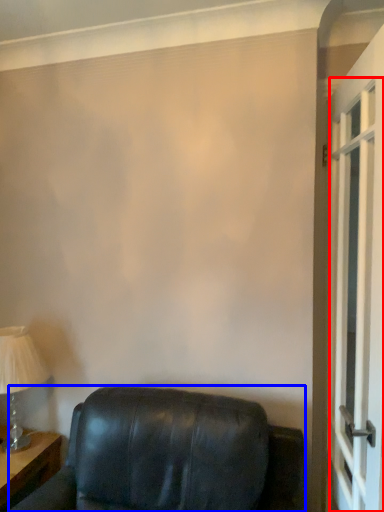
Question: Which object appears farthest to the camera in this image, screen door (highlighted by a red box) or furniture (highlighted by a blue box)?

Choices:
 (A) screen door
 (B) furniture

Answer: (A)